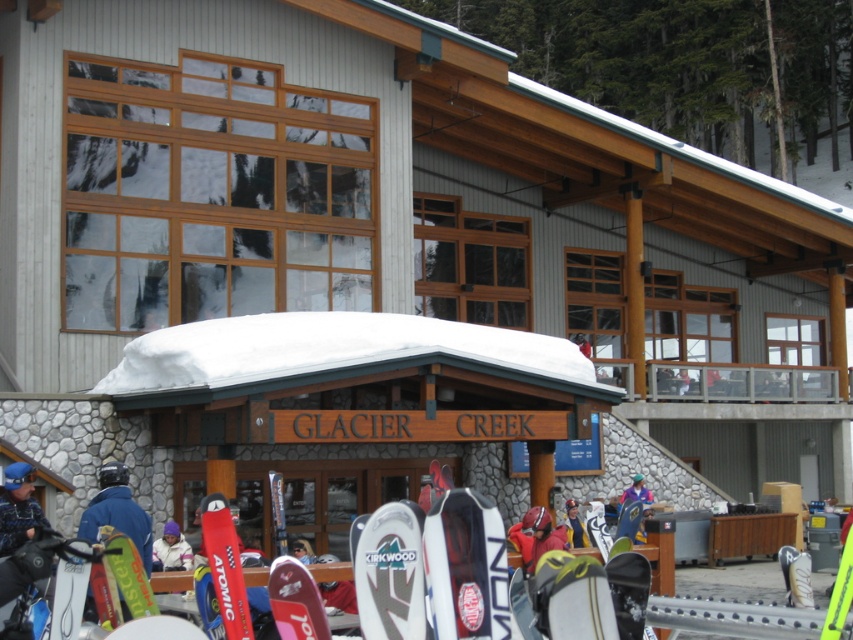
You are a photographer planning to take a group photo of the red jacket at center and the blue fabric jacket at center. Which jacket should you position closer to the camera to ensure both jackets appear the same size in the photo?

The red jacket at center has a lesser width compared to the blue fabric jacket at center. To make them appear the same size in the photo, position the red jacket at center closer to the camera since it is narrower and needs to be nearer to compensate for its smaller size.

You are standing at the entrance of the Glacier Creek ski lodge and want to locate the white fleece jacket at center. According to the coordinates provided, in which direction should you look relative to the center of the image?

The white fleece jacket at center is located at coordinates point [171,548], so you should look to the right of the center of the image since the x coordinate is greater than 0.5.